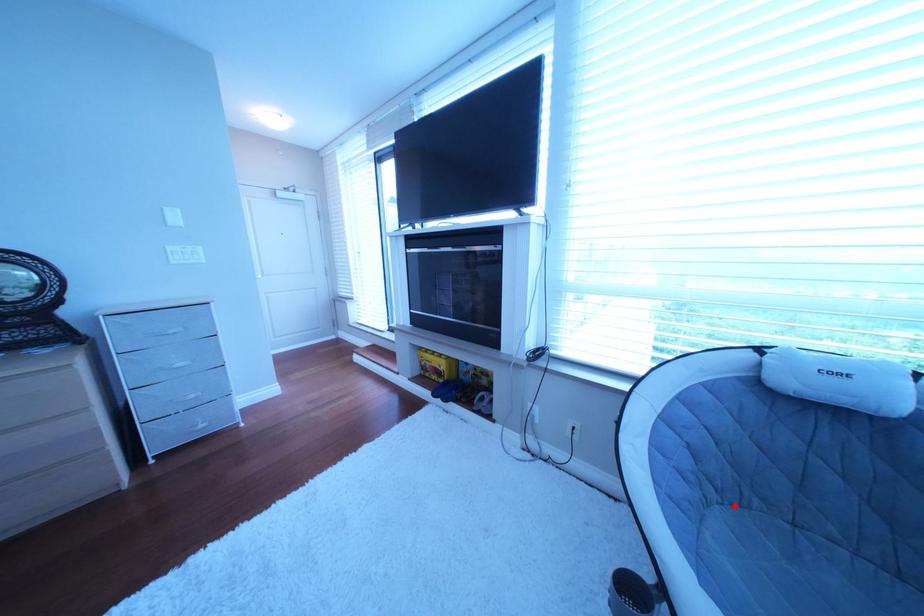
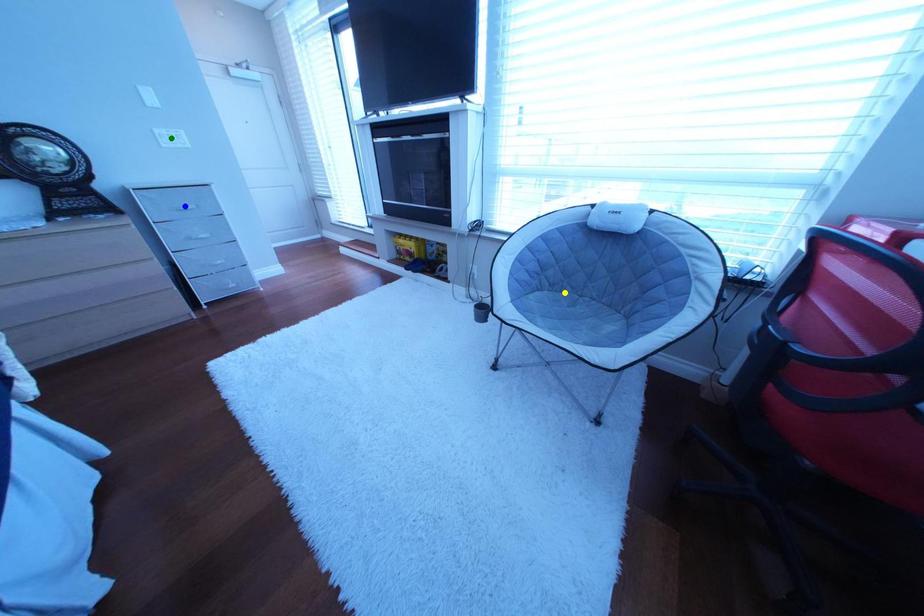
Question: I am providing you with two images of the same scene from different viewpoints. A red point is marked on the first image. You are given multiple points on the second image. Which point in image 2 represents the same 3d spot as the red point in image 1?

Choices:
 (A) green point
 (B) blue point
 (C) yellow point

Answer: (C)